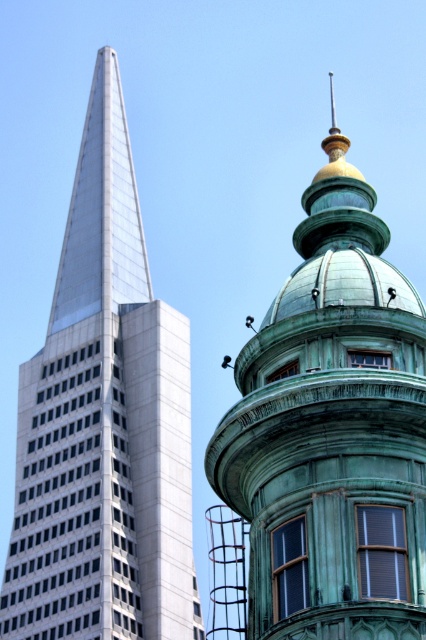
Question: Among these objects, which one is farthest from the camera?

Choices:
 (A) green patina dome at upper center
 (B) metallic glass skyscraper at left

Answer: (B)

Question: Can you confirm if green patina dome at upper center is positioned to the right of metallic glass skyscraper at left?

Choices:
 (A) no
 (B) yes

Answer: (B)

Question: Is green patina dome at upper center behind metallic glass skyscraper at left?

Choices:
 (A) no
 (B) yes

Answer: (A)

Question: Is green patina dome at upper center positioned before metallic glass skyscraper at left?

Choices:
 (A) yes
 (B) no

Answer: (A)